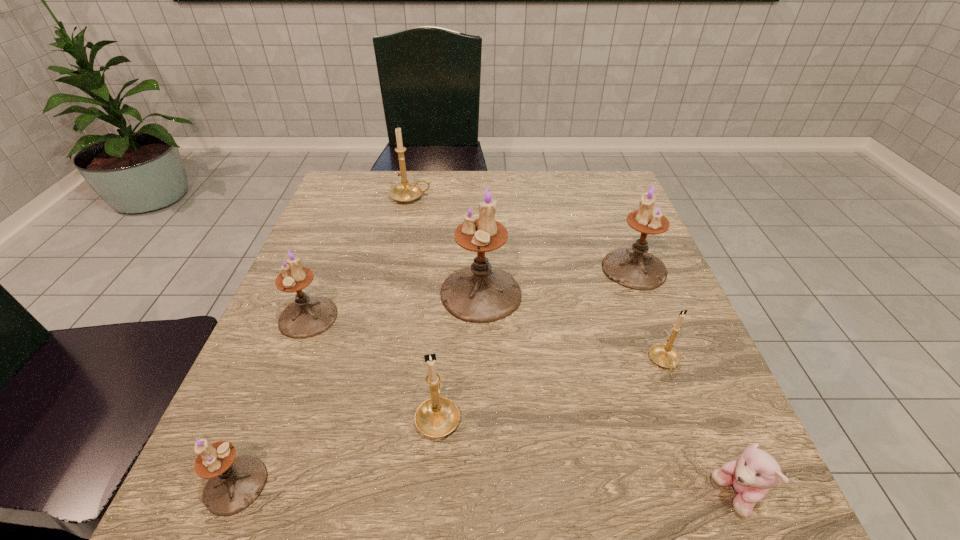
Identify the location of vacant space located on the handle side of the sixth farthest candle holder. This screenshot has height=540, width=960. (451, 250).

At what (x,y) coordinates should I click in order to perform the action: click on vacant space located on the handle side of the smallest gold candle holder. Please return your answer as a coordinate pair (x, y). Looking at the image, I should click on (711, 484).

The image size is (960, 540). Find the location of `vacant space located 0.200m on the right of the nearest candle holder`. vacant space located 0.200m on the right of the nearest candle holder is located at coordinates (406, 485).

You are a GUI agent. You are given a task and a screenshot of the screen. Output one action in this format:
    pyautogui.click(x=<x>, y=<y>)
    Task: Click on the vacant space located 0.270m at the face of the shortest object
    The width and height of the screenshot is (960, 540).
    Given the screenshot: What is the action you would take?
    pyautogui.click(x=521, y=496)

Locate an element on the screen. This screenshot has width=960, height=540. free location located at the face of the shortest object is located at coordinates (471, 496).

You are a GUI agent. You are given a task and a screenshot of the screen. Output one action in this format:
    pyautogui.click(x=<x>, y=<y>)
    Task: Click on the blank space located at the face of the shortest object
    This screenshot has width=960, height=540.
    Given the screenshot: What is the action you would take?
    pyautogui.click(x=536, y=496)

Image resolution: width=960 pixels, height=540 pixels. What are the coordinates of `object present at the far edge` in the screenshot? It's located at (405, 192).

You are a GUI agent. You are given a task and a screenshot of the screen. Output one action in this format:
    pyautogui.click(x=<x>, y=<y>)
    Task: Click on the candle holder at the near edge
    The image size is (960, 540).
    Given the screenshot: What is the action you would take?
    pyautogui.click(x=234, y=483)

In order to click on teddy bear situated at the near edge in this screenshot , I will do `click(751, 476)`.

Where is `teddy bear that is at the right edge`? teddy bear that is at the right edge is located at coordinates coord(751,476).